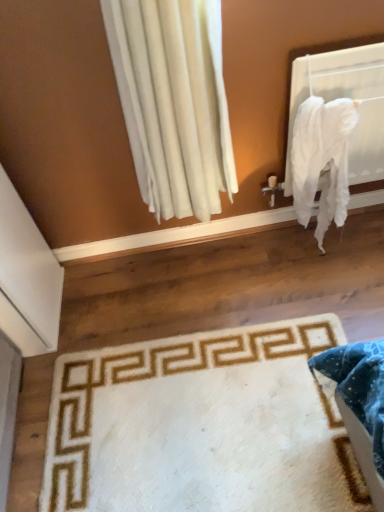
Identify the location of vacant space situated on the left part of white cotton blanket at right. (259, 264).